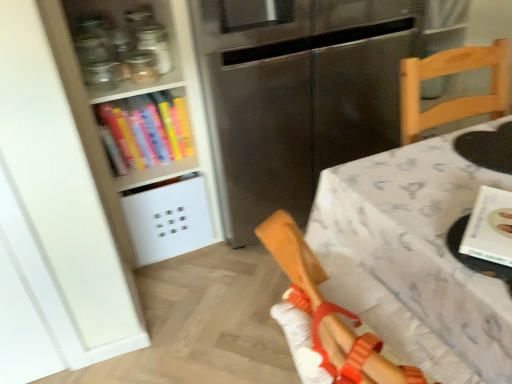
Question: In the image, is hardcover book at upper left, which is counted as the 2th book, starting from the bottom, positioned in front of or behind stainless steel fridge at center?

Choices:
 (A) front
 (B) behind

Answer: (B)

Question: Is point (100, 134) positioned closer to the camera than point (398, 31)?

Choices:
 (A) closer
 (B) farther

Answer: (A)

Question: Which of these objects is positioned closest to the hardcover book at upper left, which is counted as the 2th book, starting from the bottom?

Choices:
 (A) wooden chair at right
 (B) transparent glass jar at upper left
 (C) stainless steel fridge at center
 (D) white paper book at right, acting as the 1th book starting from the right
 (E) white textured tablecloth at center

Answer: (B)

Question: Which object is the closest to the stainless steel fridge at center?

Choices:
 (A) wooden chair at right
 (B) hardcover book at upper left, the 1th book when ordered from back to front
 (C) white textured tablecloth at center
 (D) transparent glass jar at upper left
 (E) white paper book at right, placed as the 2th book when sorted from top to bottom

Answer: (B)